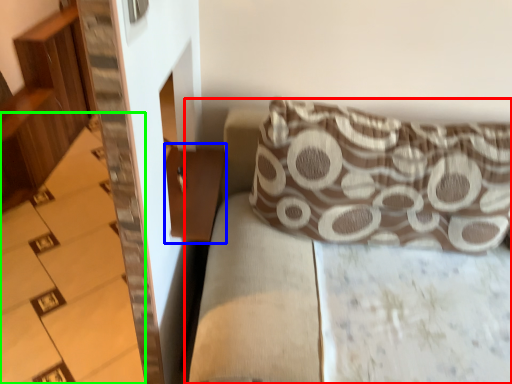
Question: Based on their relative distances, which object is nearer to couch (highlighted by a red box)? Choose from table (highlighted by a blue box) and stairwell (highlighted by a green box).

Choices:
 (A) table
 (B) stairwell

Answer: (A)